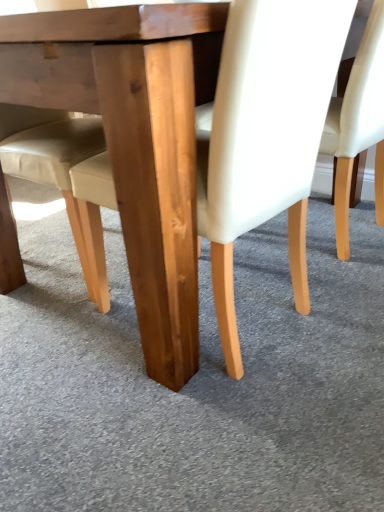
Locate an element on the screen. light brown wood chair at center is located at coordinates (266, 135).

What do you see at coordinates (266, 135) in the screenshot?
I see `light brown wood chair at center` at bounding box center [266, 135].

Where is `light brown wood chair at center`? The image size is (384, 512). light brown wood chair at center is located at coordinates (266, 135).